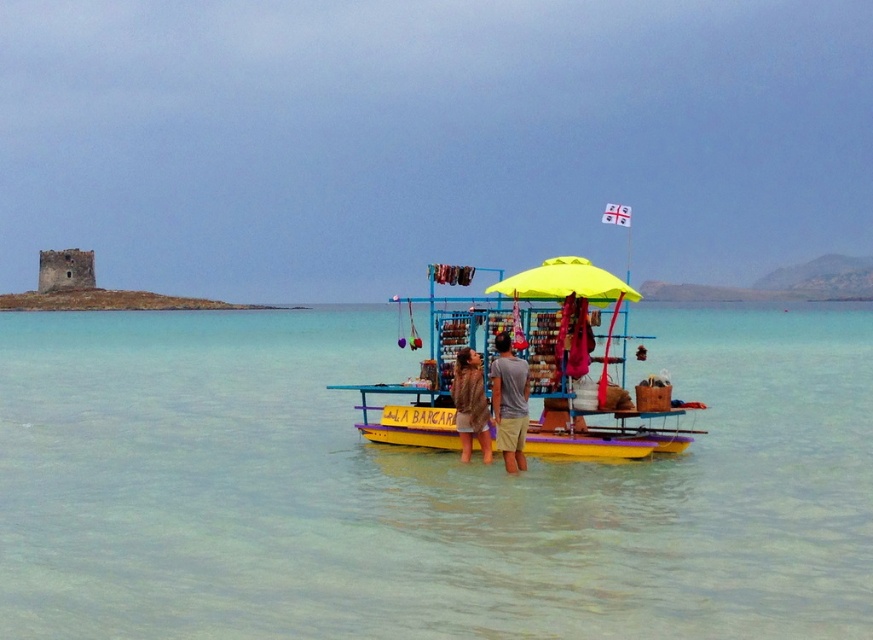
Question: Among these objects, which one is nearest to the camera?

Choices:
 (A) yellow fabric umbrella at center
 (B) clear water at center
 (C) brown fur coat at center

Answer: (B)

Question: Is clear water at center above light brown cotton shorts at center?

Choices:
 (A) yes
 (B) no

Answer: (A)

Question: Is yellow wooden boat at center smaller than brown fur coat at center?

Choices:
 (A) no
 (B) yes

Answer: (A)

Question: Does clear water at center appear on the right side of light brown cotton shorts at center?

Choices:
 (A) yes
 (B) no

Answer: (B)

Question: Which of the following is the closest to the observer?

Choices:
 (A) (509, 330)
 (B) (455, 388)
 (C) (97, 417)

Answer: (B)

Question: Which object is positioned closest to the light brown cotton shorts at center?

Choices:
 (A) brown fur coat at center
 (B) yellow wooden boat at center

Answer: (A)